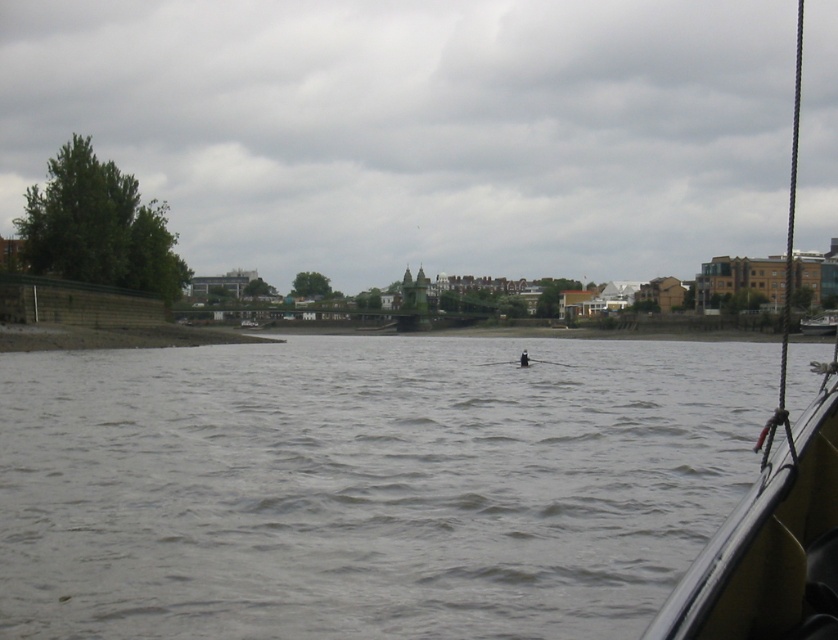
Question: Does metallic silver boat at lower right appear under white fabric person at center?

Choices:
 (A) yes
 (B) no

Answer: (B)

Question: Estimate the real-world distances between objects in this image. Which object is closer to the black rubber paddle at center?

Choices:
 (A) black rubber boat at right
 (B) cloudy sky at upper center
 (C) metallic silver boat at lower right

Answer: (A)

Question: Can you confirm if gray water at center is positioned to the left of black rubber boat at right?

Choices:
 (A) yes
 (B) no

Answer: (A)

Question: Which point is farther from the camera taking this photo?

Choices:
 (A) (438, 33)
 (B) (834, 326)
 (C) (330, 352)

Answer: (A)

Question: Can you confirm if gray water at center is positioned above cloudy sky at upper center?

Choices:
 (A) no
 (B) yes

Answer: (A)

Question: Which object appears farthest from the camera in this image?

Choices:
 (A) white fabric person at center
 (B) metallic silver boat at lower right

Answer: (B)